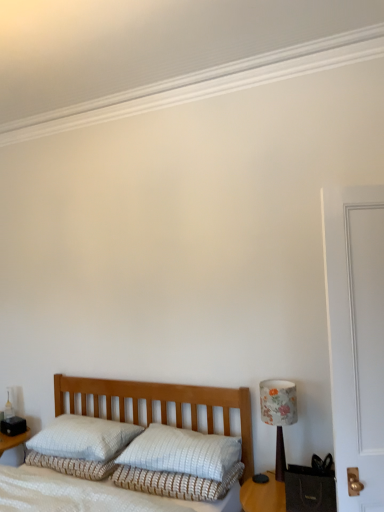
Question: Is white textured pillow at center, which appears as the 2th pillow when viewed from the left, in front of or behind wooden table at lower right in the image?

Choices:
 (A) front
 (B) behind

Answer: (B)

Question: From a real-world perspective, is white textured pillow at center, which is the first pillow from right to left, positioned above or below wooden table at lower right?

Choices:
 (A) above
 (B) below

Answer: (A)

Question: Estimate the real-world distances between objects in this image. Which object is closer to the white textured bed at center?

Choices:
 (A) white textured pillow at center
 (B) floral fabric lampshade at right
 (C) white textured pillow at center, which appears as the 2th pillow when viewed from the left
 (D) white textured pillow at center, which is the 2th pillow from right to left
 (E) wooden table at lower right

Answer: (C)

Question: Which object is positioned farthest from the wooden table at lower right?

Choices:
 (A) white textured pillow at center, which appears as the 2th pillow when viewed from the left
 (B) white textured pillow at center, placed as the 1th pillow when sorted from left to right
 (C) white textured pillow at center
 (D) white textured bed at center
 (E) floral fabric lampshade at right

Answer: (B)